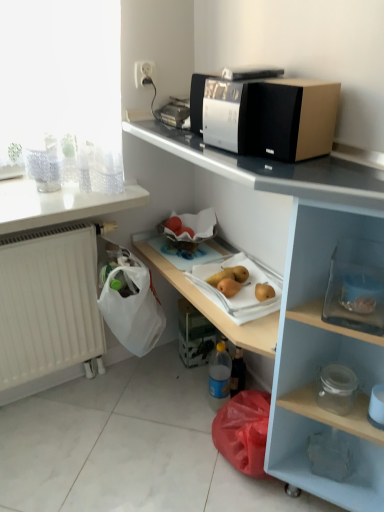
Where is `vacant space situated above white matte radiator at lower left (from a real-world perspective)`? Image resolution: width=384 pixels, height=512 pixels. vacant space situated above white matte radiator at lower left (from a real-world perspective) is located at coordinates (53, 227).